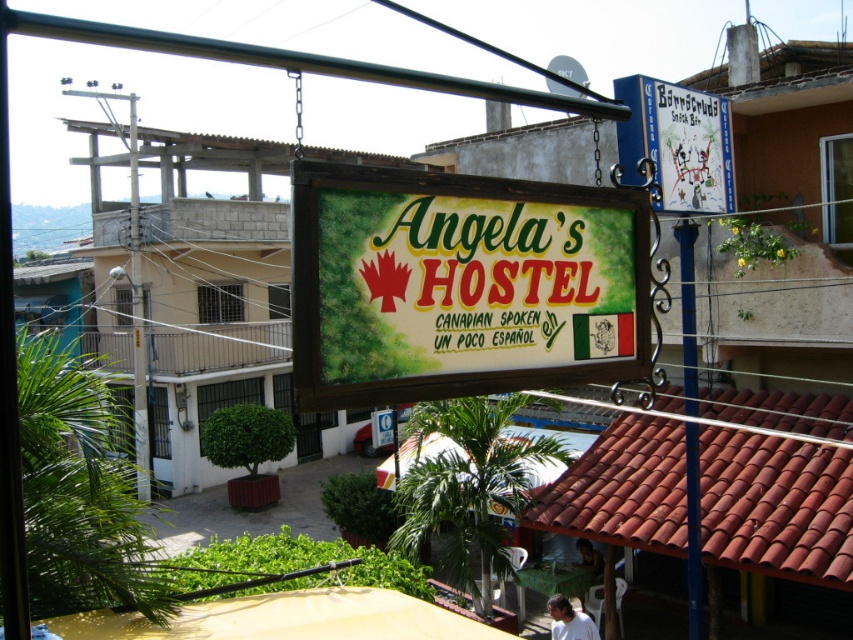
Question: Which object is farther from the camera taking this photo?

Choices:
 (A) white matte shirt at lower center
 (B) blue metal pole at center
 (C) white fabric shirt at lower center
 (D) wooden signboard at center

Answer: (C)

Question: Estimate the real-world distances between objects in this image. Which object is closer to the wooden signboard at center?

Choices:
 (A) white matte shirt at lower center
 (B) blue metal pole at center

Answer: (B)

Question: Which object is the closest to the white fabric shirt at lower center?

Choices:
 (A) blue metal pole at center
 (B) white matte shirt at lower center
 (C) wooden signboard at center

Answer: (B)

Question: Is wooden signboard at center behind white matte shirt at lower center?

Choices:
 (A) no
 (B) yes

Answer: (A)

Question: Is blue painted wood sign at upper right positioned behind blue metal pole at center?

Choices:
 (A) no
 (B) yes

Answer: (A)

Question: Is wooden signboard at center wider than white fabric shirt at lower center?

Choices:
 (A) no
 (B) yes

Answer: (B)